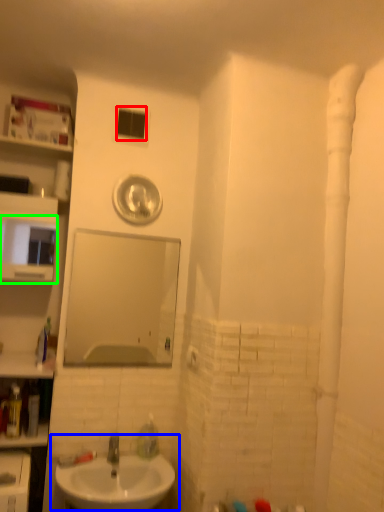
Question: Which object is the farthest from window (highlighted by a red box)? Choose among these: sink (highlighted by a blue box) or medicine cabinet (highlighted by a green box).

Choices:
 (A) sink
 (B) medicine cabinet

Answer: (A)